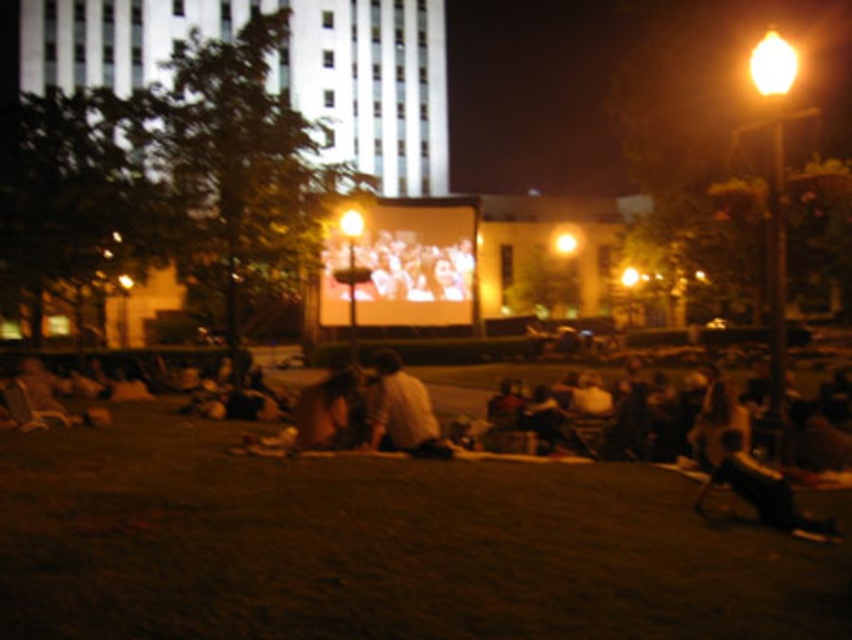
Question: Can you confirm if matte screen at center is smaller than light brown fabric shirt at center?

Choices:
 (A) yes
 (B) no

Answer: (B)

Question: Among these points, which one is nearest to the camera?

Choices:
 (A) (442, 237)
 (B) (373, 419)

Answer: (B)

Question: Is matte screen at center below light brown fabric shirt at center?

Choices:
 (A) no
 (B) yes

Answer: (A)

Question: Is matte screen at center to the right of light brown fabric shirt at center from the viewer's perspective?

Choices:
 (A) yes
 (B) no

Answer: (B)

Question: Which object is closer to the camera taking this photo?

Choices:
 (A) matte screen at center
 (B) light brown fabric shirt at center

Answer: (B)